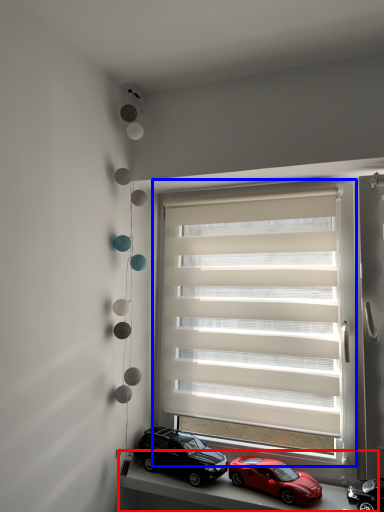
Question: Which object is further to the camera taking this photo, window sill (highlighted by a red box) or window blind (highlighted by a blue box)?

Choices:
 (A) window sill
 (B) window blind

Answer: (B)